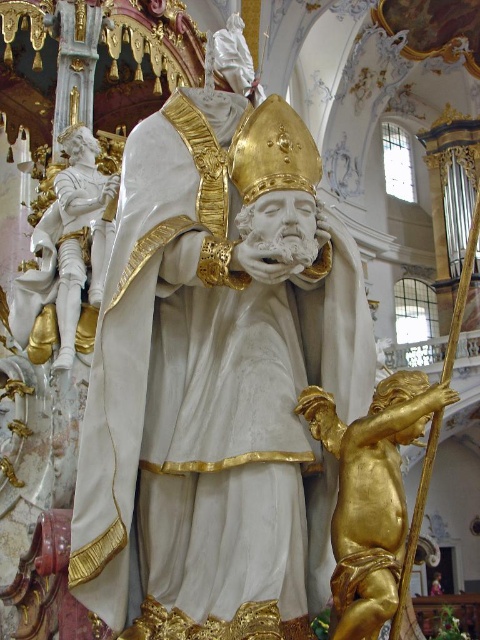
Question: Which object appears closest to the camera in this image?

Choices:
 (A) gold polished cherub at lower right
 (B) white glossy statue at left

Answer: (A)

Question: Can you confirm if white marble statue at center is positioned to the left of gold polished cherub at lower right?

Choices:
 (A) yes
 (B) no

Answer: (A)

Question: Which object is positioned farthest from the white marble statue at center?

Choices:
 (A) gold polished cherub at lower right
 (B) white glossy statue at left

Answer: (B)

Question: Which is nearer to the white glossy statue at left?

Choices:
 (A) white marble statue at center
 (B) gold polished cherub at lower right

Answer: (A)

Question: Does white marble statue at center appear over gold polished cherub at lower right?

Choices:
 (A) yes
 (B) no

Answer: (A)

Question: Can you confirm if white marble statue at center is positioned below gold polished cherub at lower right?

Choices:
 (A) yes
 (B) no

Answer: (B)